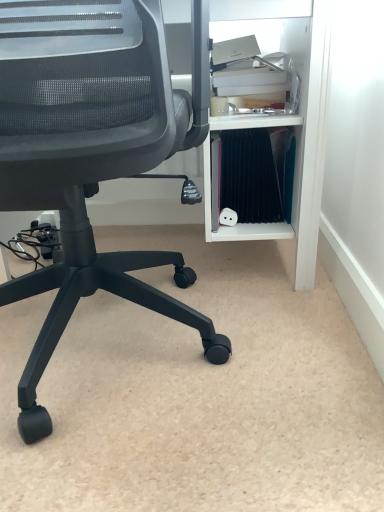
Locate an element on the screen. Image resolution: width=384 pixels, height=512 pixels. free spot below black mesh chair at left (from a real-world perspective) is located at coordinates (93, 349).